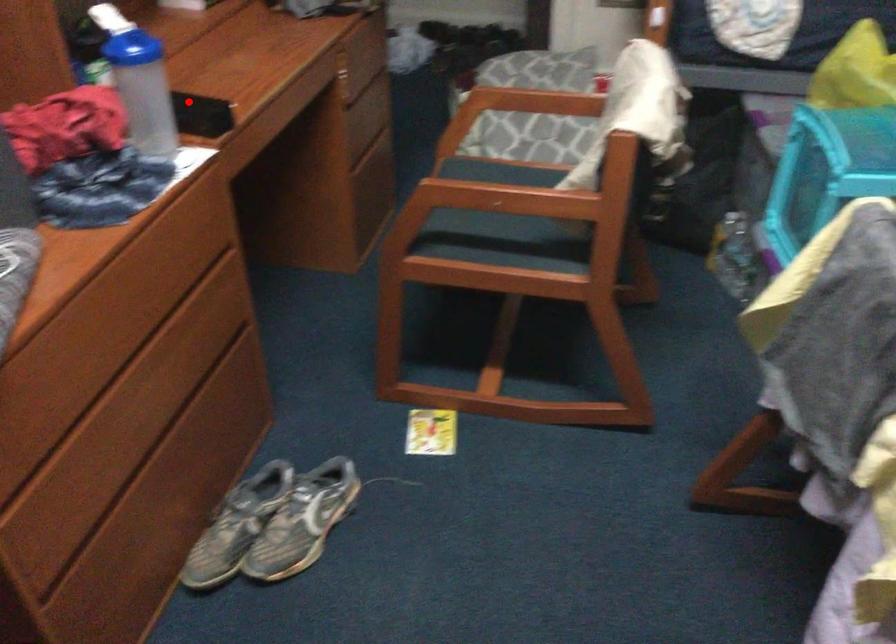
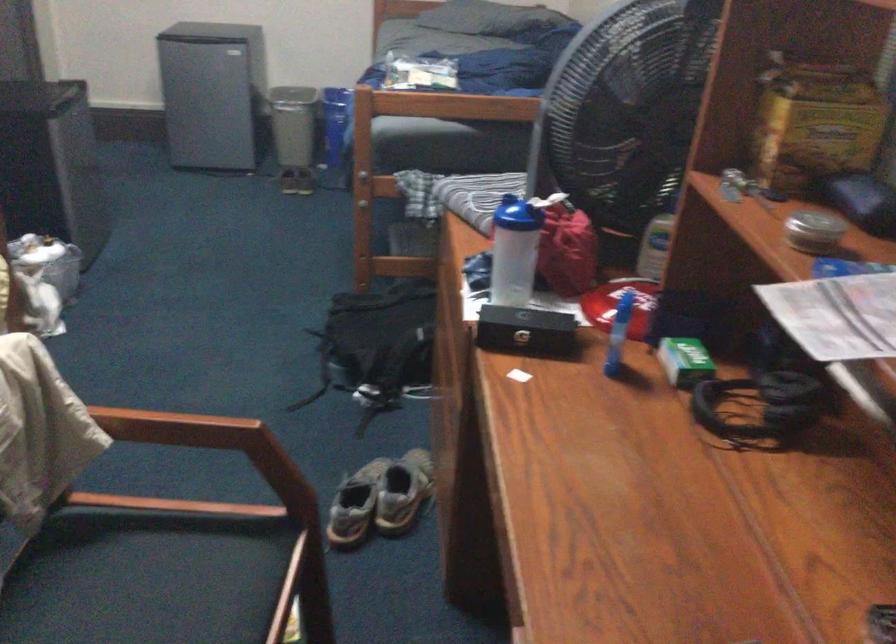
The point at the highlighted location is marked in the first image. Where is the corresponding point in the second image?

(526, 330)